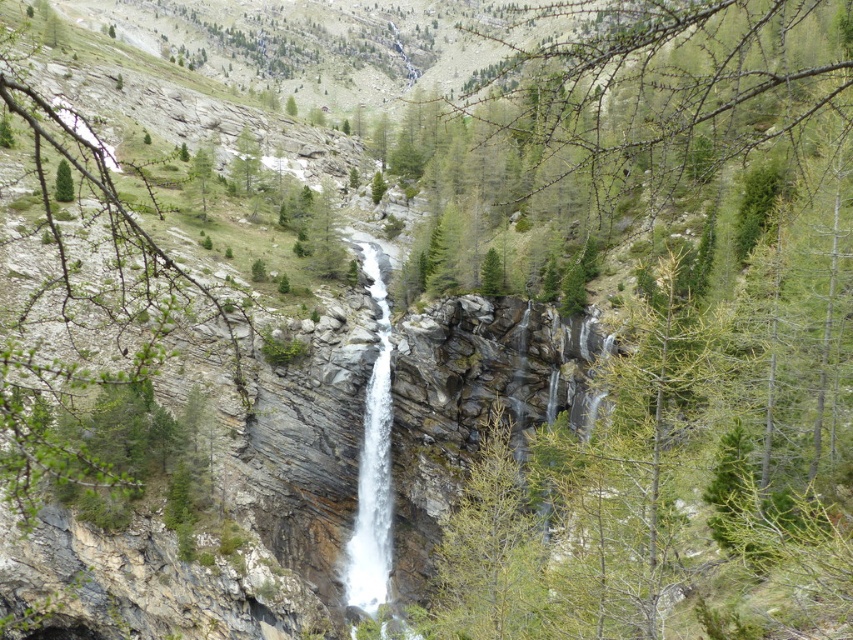
You are a hiker who wants to take a photo of both the green leafy branch at center and the green matte tree at upper left in the same frame. Given that your camera has a 50mm lens, which has a field of view of approximately 46 degrees, can you estimate if both objects will fit in the frame without moving the camera? Please consider their distance apart and the lens specifications.

The green leafy branch at center and the green matte tree at upper left are 22.72 meters apart. With a 50mm lens having a 46 degree field of view, the maximum distance between two objects that can fit in the frame can be calculated. However, without knowing the distance from the camera to the objects, it is impossible to determine if 22.72 meters falls within the field of view. Additional information about the camera position relative to the subjects is needed for an accurate assessment.

You are a landscape photographer planning to capture the white smooth waterfall at center and the green matte tree at upper left in a single shot. Based on their widths, which object would require you to adjust your camera angle to fit entirely within the frame?

The green matte tree at upper left requires adjusting the camera angle because it is wider than the white smooth waterfall at center.